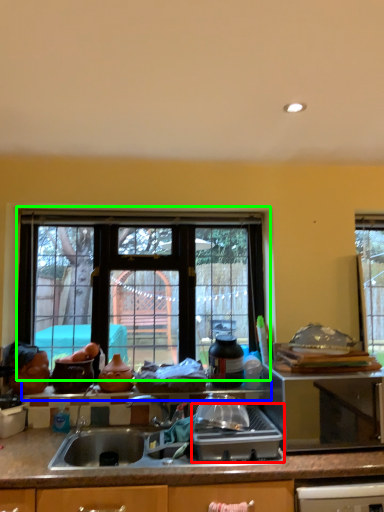
Question: Which is nearer to the kitchen appliance (highlighted by a red box)? window sill (highlighted by a blue box) or window (highlighted by a green box).

Choices:
 (A) window sill
 (B) window

Answer: (A)